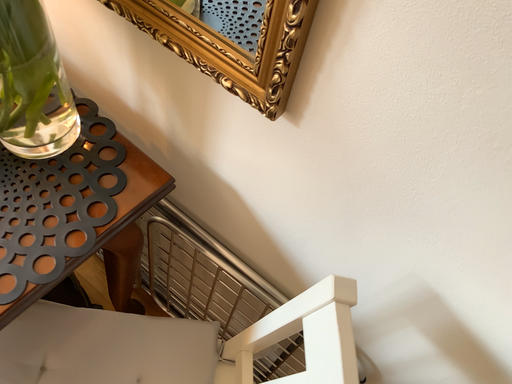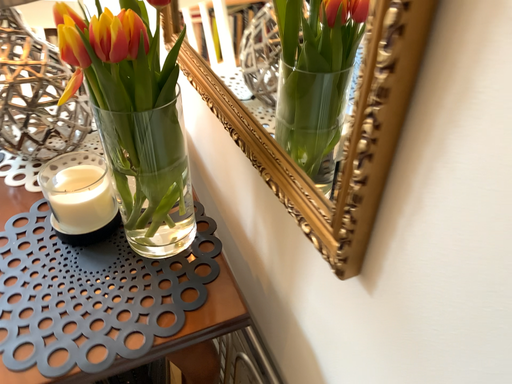
Question: How did the camera likely rotate when shooting the video?

Choices:
 (A) rotated right
 (B) rotated left

Answer: (B)